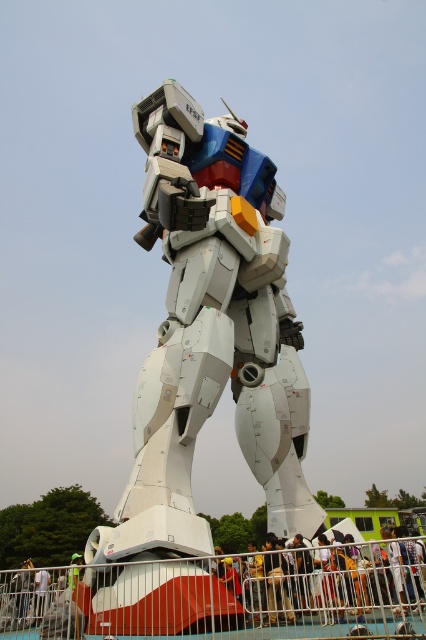
You are a photographer trying to capture a clear photo of the white metallic robot at center without any obstructions. There is a yellow fabric person at center in the way. Based on their positions, can you take the photo from your current viewpoint?

The white metallic robot at center is located above the yellow fabric person at center, so you can take the photo from your current viewpoint as the robot is positioned higher and won